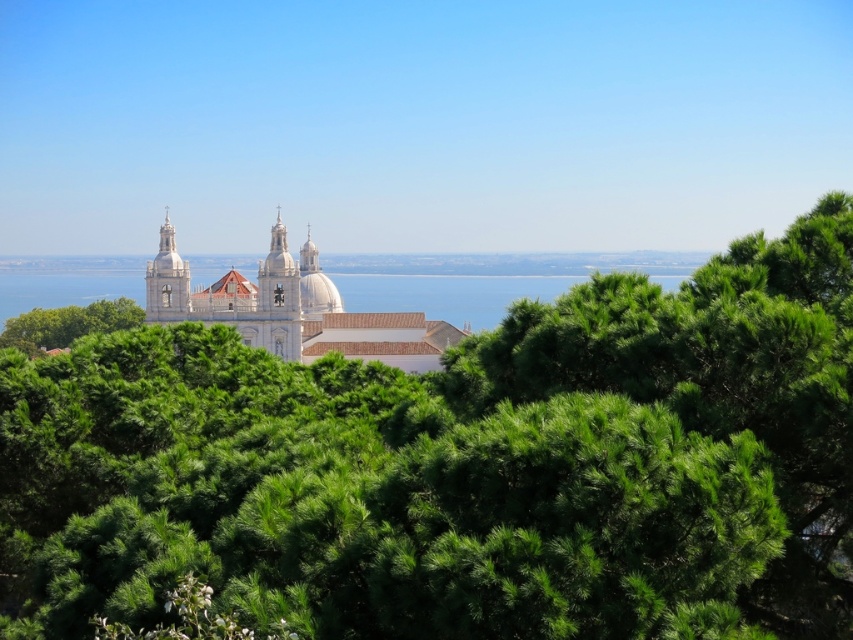
Question: Estimate the real-world distances between objects in this image. Which object is farther from the white smooth church at center?

Choices:
 (A) green leafy tree at center
 (B) blue water at center
 (C) green leafy tree at lower left

Answer: (A)

Question: Which point is closer to the camera taking this photo?

Choices:
 (A) (25, 342)
 (B) (498, 307)
 (C) (366, 323)
 (D) (608, 390)

Answer: (D)

Question: Observing the image, what is the correct spatial positioning of green leafy tree at center in reference to green leafy tree at lower left?

Choices:
 (A) left
 (B) right

Answer: (B)

Question: Does green leafy tree at center appear over white smooth church at center?

Choices:
 (A) yes
 (B) no

Answer: (B)

Question: Does green leafy tree at center have a greater width compared to blue water at center?

Choices:
 (A) no
 (B) yes

Answer: (A)

Question: Which point is closer to the camera taking this photo?

Choices:
 (A) (218, 305)
 (B) (497, 300)
 (C) (102, 312)

Answer: (A)